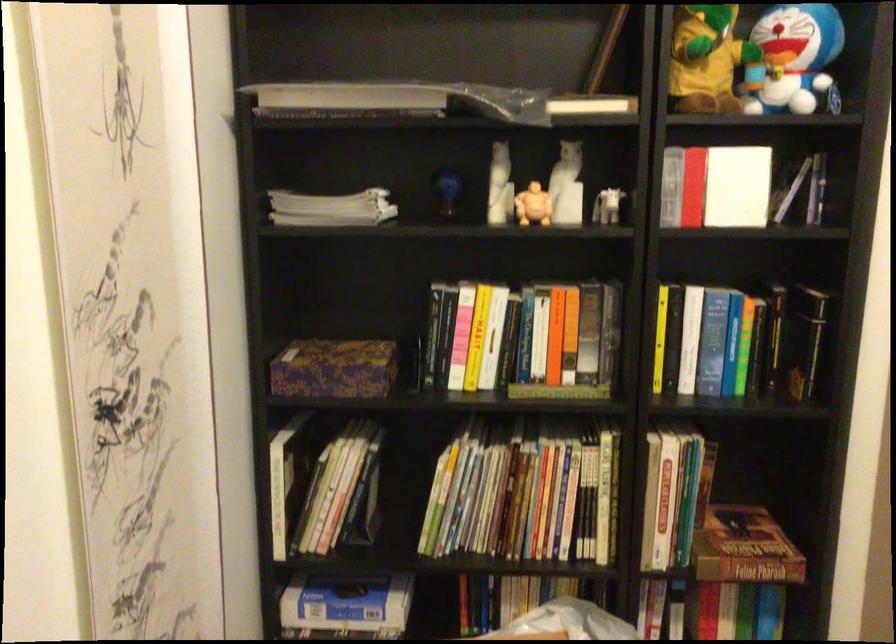
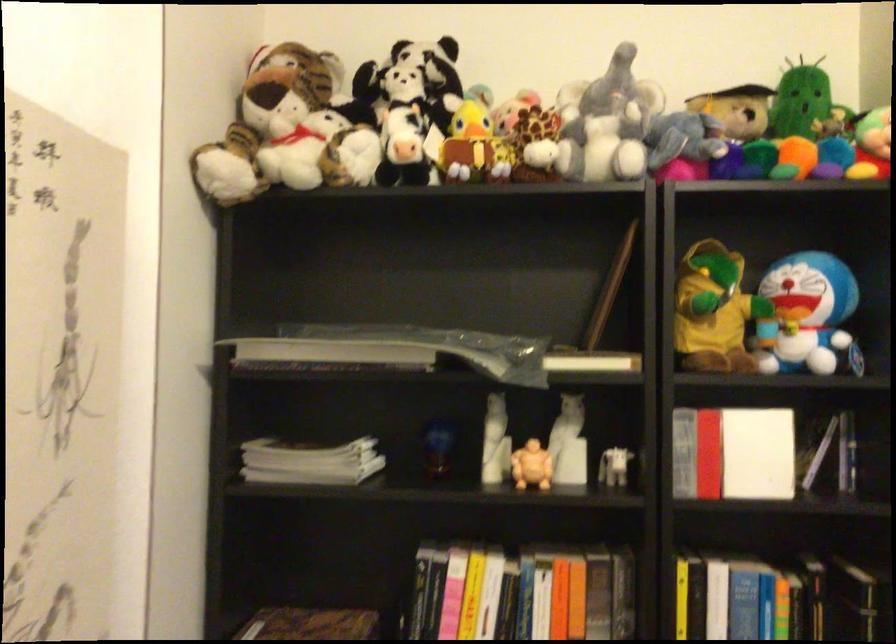
Locate, in the second image, the point that corresponds to (748,314) in the first image.

(780, 599)